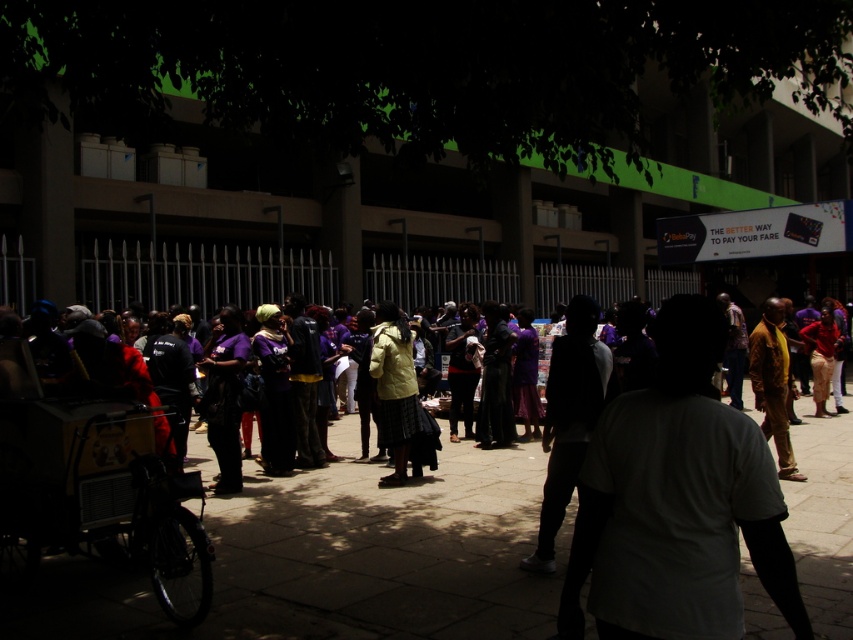
You are a fashion designer observing the scene and want to create a new collection inspired by the clothing seen here. Which of the two items, the dark fabric pants at center or the yellow fabric skirt at center, would you choose to feature as a main piece if you want to highlight a larger garment?

The dark fabric pants at center is larger in size than the yellow fabric skirt at center, so you should choose the dark fabric pants at center as the main piece to highlight a larger garment.

You are a photographer trying to capture a shot of the yellow fabric skirt at center and the brown textured shirt at right. Based on their positions, which one would appear larger in your photo?

The yellow fabric skirt at center appears larger in the photo because it is much taller than the brown textured shirt at right.